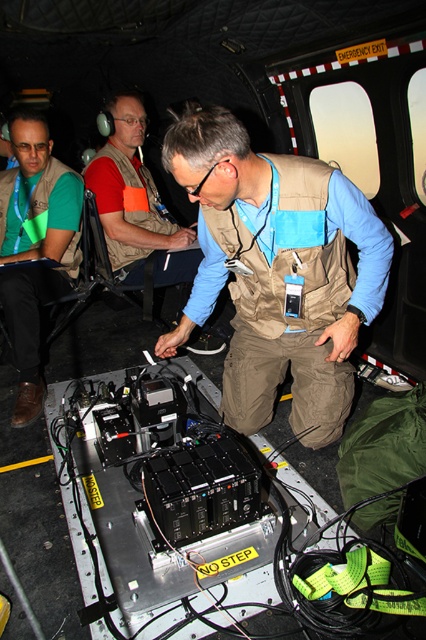
You are a technician inside the helicopter and need to access both the tan fabric vest at center and the matte brown vest at center. Which vest should you reach for first to grab the one closer to you?

The tan fabric vest at center is closer to the viewer than the matte brown vest at center, so you should reach for the tan fabric vest at center first.

You are a safety inspector in the helicopter. You need to ensure that all safety regulations are followed. The minimum required distance between two crew members wearing different colored vests is 1.5 meters. Are the tan fabric vest at center and matte green vest at lower left compliant with this regulation?

The tan fabric vest at center and matte green vest at lower left are 1.24 meters apart, which is less than the required 1.5 meters. Therefore, they are not compliant with the safety regulation.